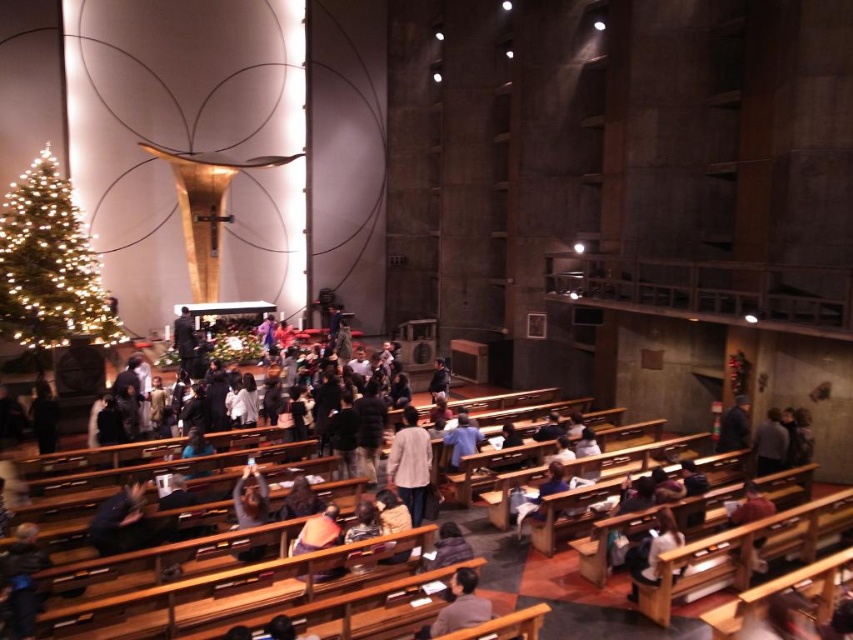
You are attending a Christmas service and need to sit down. You see a light gray sweater at center and a light brown wooden bench at lower center. Which object can you sit on?

The light brown wooden bench at lower center is the object you can sit on. The light gray sweater at center is larger in size but is likely clothing and not meant for sitting.

You are standing at the entrance of the modern church and notice two points marked in the scene. Which of the two points, point (425, 472) or point (471, 604), is closer to you?

Point (425, 472) is further to the camera than point (471, 604), so the point closer to you is point (471, 604).